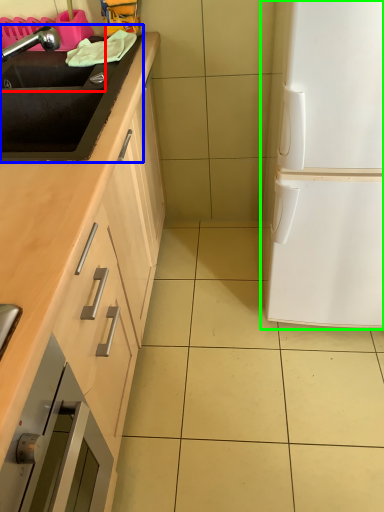
Question: Which object is positioned closest to sink (highlighted by a red box)? Select from sink (highlighted by a blue box) and fridge (highlighted by a green box).

Choices:
 (A) sink
 (B) fridge

Answer: (A)